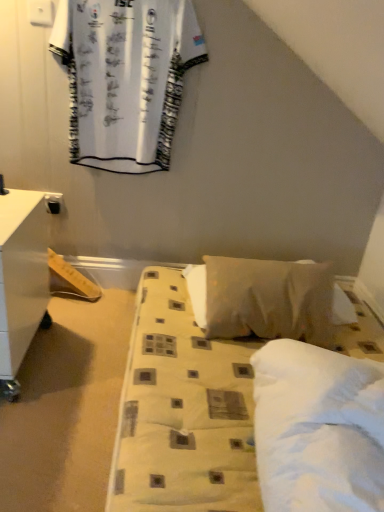
Question: Does white fabric bed at center have a greater height compared to white soft pillow at center?

Choices:
 (A) yes
 (B) no

Answer: (B)

Question: Is white fabric bed at center further to the viewer compared to white soft pillow at center?

Choices:
 (A) yes
 (B) no

Answer: (B)

Question: Is white fabric bed at center shorter than white soft pillow at center?

Choices:
 (A) no
 (B) yes

Answer: (B)

Question: Does white fabric bed at center contain white soft pillow at center?

Choices:
 (A) no
 (B) yes

Answer: (A)

Question: Is white fabric bed at center with white soft pillow at center?

Choices:
 (A) yes
 (B) no

Answer: (B)

Question: Would you say white fabric bed at center is to the left or to the right of white glossy nightstand at left in the picture?

Choices:
 (A) left
 (B) right

Answer: (B)

Question: Is point (172, 449) positioned closer to the camera than point (14, 367)?

Choices:
 (A) closer
 (B) farther

Answer: (A)

Question: Is white fabric bed at center situated inside white glossy nightstand at left or outside?

Choices:
 (A) outside
 (B) inside

Answer: (A)

Question: Is white fabric bed at center in front of or behind white glossy nightstand at left in the image?

Choices:
 (A) front
 (B) behind

Answer: (A)

Question: Considering the positions of white soft pillow at center and white glossy nightstand at left in the image, is white soft pillow at center taller or shorter than white glossy nightstand at left?

Choices:
 (A) short
 (B) tall

Answer: (A)

Question: From the image's perspective, is white soft pillow at center located above or below white glossy nightstand at left?

Choices:
 (A) below
 (B) above

Answer: (A)

Question: Considering the positions of point (319, 273) and point (31, 337), is point (319, 273) closer or farther from the camera than point (31, 337)?

Choices:
 (A) closer
 (B) farther

Answer: (A)

Question: Considering the positions of white soft pillow at center and white glossy nightstand at left in the image, is white soft pillow at center wider or thinner than white glossy nightstand at left?

Choices:
 (A) wide
 (B) thin

Answer: (B)

Question: Is white glossy nightstand at left wider or thinner than white soft pillow at center?

Choices:
 (A) wide
 (B) thin

Answer: (A)

Question: Is white glossy nightstand at left taller or shorter than white soft pillow at center?

Choices:
 (A) tall
 (B) short

Answer: (A)